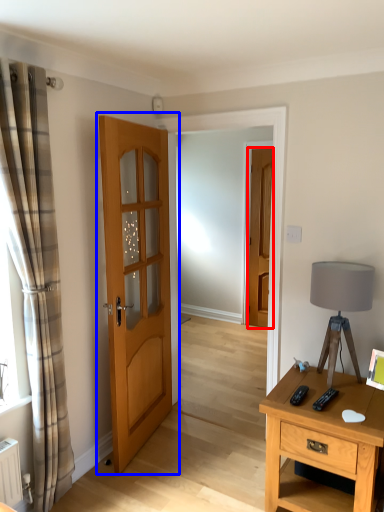
Question: Which point is further to the camera, door (highlighted by a red box) or door (highlighted by a blue box)?

Choices:
 (A) door
 (B) door

Answer: (A)